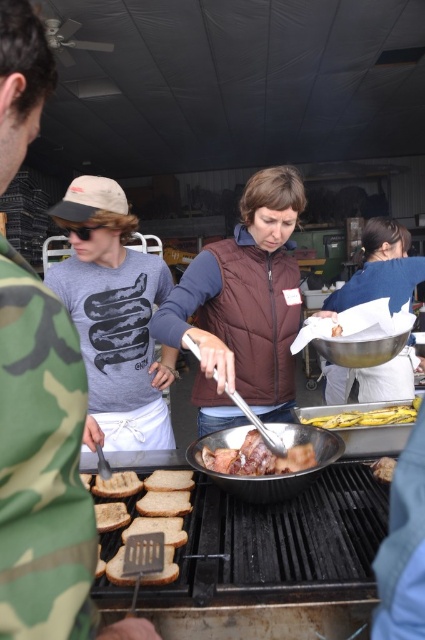
Question: Among these points, which one is farthest from the camera?

Choices:
 (A) (294, 468)
 (B) (311, 424)

Answer: (B)

Question: Does matte gray t-shirt at center appear under white paper towel at center?

Choices:
 (A) yes
 (B) no

Answer: (A)

Question: Which point is farther to the camera?

Choices:
 (A) shiny metallic pan at center
 (B) matte gray t-shirt at center

Answer: (A)

Question: Which point is closer to the camera taking this photo?

Choices:
 (A) (99, 484)
 (B) (274, 499)
 (C) (407, 417)

Answer: (B)

Question: Considering the relative positions of white paper towel at center and shiny metallic pan at center in the image provided, where is white paper towel at center located with respect to shiny metallic pan at center?

Choices:
 (A) below
 (B) above

Answer: (B)

Question: Is matte gray t-shirt at center behind shiny metallic pan at center?

Choices:
 (A) no
 (B) yes

Answer: (A)